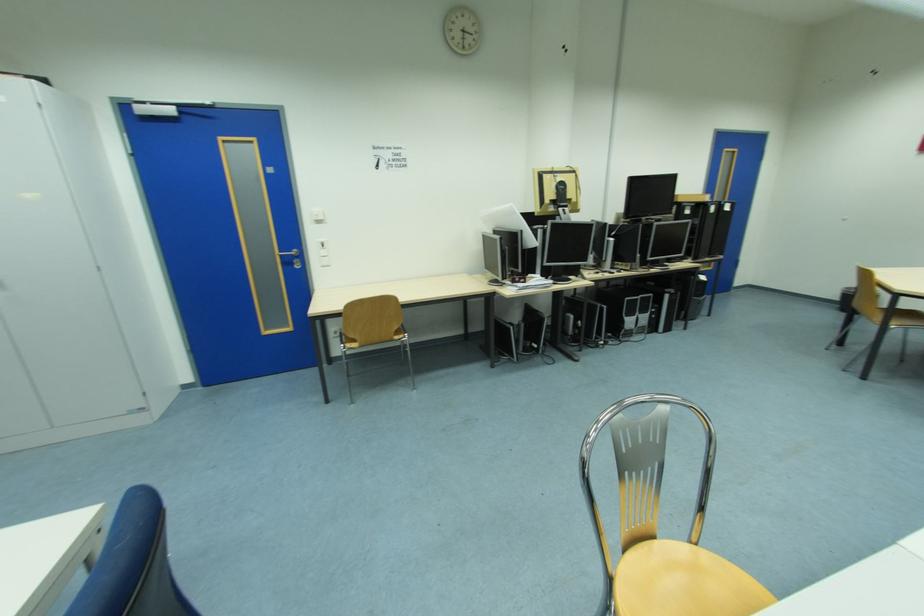
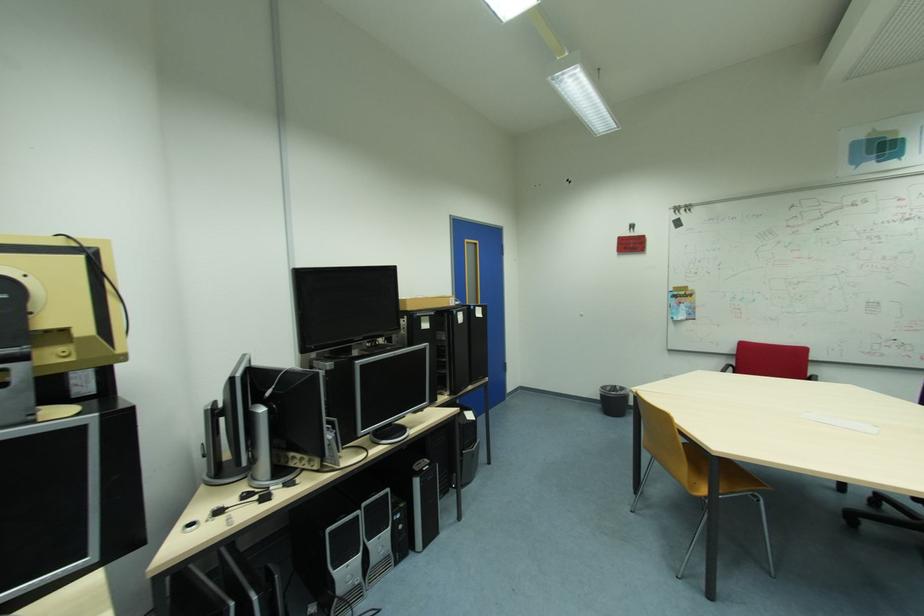
Locate, in the second image, the point that corresponds to the point at 634,300 in the first image.

(335, 530)